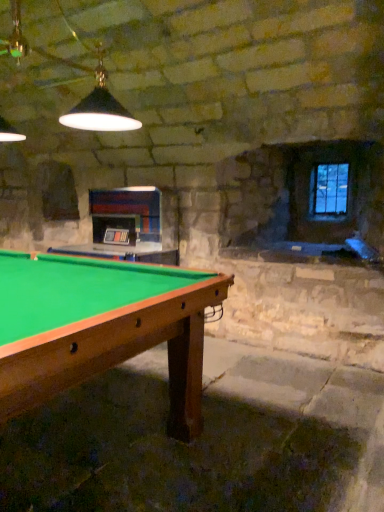
Question: Is green felt pool table at center thinner than blue glass window at upper right?

Choices:
 (A) yes
 (B) no

Answer: (B)

Question: From a real-world perspective, is green felt pool table at center physically below blue glass window at upper right?

Choices:
 (A) no
 (B) yes

Answer: (B)

Question: Is green felt pool table at center looking in the opposite direction of blue glass window at upper right?

Choices:
 (A) no
 (B) yes

Answer: (B)

Question: Is blue glass window at upper right inside green felt pool table at center?

Choices:
 (A) no
 (B) yes

Answer: (A)

Question: Considering the relative sizes of green felt pool table at center and blue glass window at upper right in the image provided, is green felt pool table at center bigger than blue glass window at upper right?

Choices:
 (A) no
 (B) yes

Answer: (B)

Question: From the image's perspective, is green felt pool table at center on blue glass window at upper right?

Choices:
 (A) no
 (B) yes

Answer: (A)

Question: From a real-world perspective, is blue glass window at upper right on green felt pool table at center?

Choices:
 (A) no
 (B) yes

Answer: (B)

Question: Is blue glass window at upper right beside green felt pool table at center?

Choices:
 (A) no
 (B) yes

Answer: (A)

Question: Considering the relative positions of blue glass window at upper right and green felt pool table at center in the image provided, is blue glass window at upper right to the right of green felt pool table at center from the viewer's perspective?

Choices:
 (A) yes
 (B) no

Answer: (A)

Question: Is blue glass window at upper right positioned behind green felt pool table at center?

Choices:
 (A) no
 (B) yes

Answer: (B)

Question: Considering the relative sizes of blue glass window at upper right and green felt pool table at center in the image provided, is blue glass window at upper right thinner than green felt pool table at center?

Choices:
 (A) yes
 (B) no

Answer: (A)

Question: Considering the relative positions of blue glass window at upper right and green felt pool table at center in the image provided, is blue glass window at upper right in front of green felt pool table at center?

Choices:
 (A) yes
 (B) no

Answer: (B)

Question: Is green felt pool table at center inside or outside of blue glass window at upper right?

Choices:
 (A) outside
 (B) inside

Answer: (A)